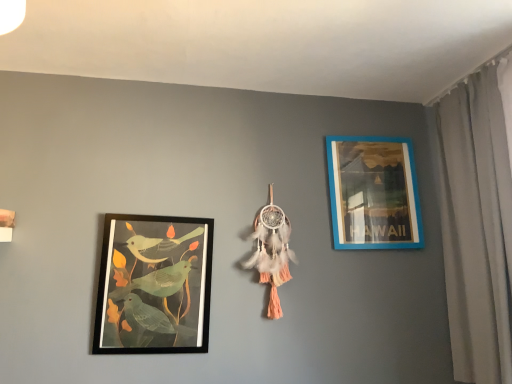
Locate an element on the screen. The height and width of the screenshot is (384, 512). white fabric curtain at right is located at coordinates (476, 227).

What is the approximate width of blue plastic picture frame at upper right, which appears as the first picture frame when viewed from the back?

blue plastic picture frame at upper right, which appears as the first picture frame when viewed from the back, is 1.79 inches in width.

Where is `blue plastic picture frame at upper right, the 2th picture frame positioned from the front`? This screenshot has height=384, width=512. blue plastic picture frame at upper right, the 2th picture frame positioned from the front is located at coordinates 373,193.

Where is `white fabric curtain at right`? The image size is (512, 384). white fabric curtain at right is located at coordinates (476, 227).

From the image's perspective, which object appears higher, blue plastic picture frame at upper right, the 2th picture frame positioned from the front, or white fabric curtain at right?

blue plastic picture frame at upper right, the 2th picture frame positioned from the front, is shown above in the image.

Looking at this image, from a real-world perspective, which object stands above the other?

blue plastic picture frame at upper right, which appears as the first picture frame when viewed from the back.

Considering the relative sizes of blue plastic picture frame at upper right, arranged as the first picture frame when viewed from the right, and white fabric curtain at right in the image provided, is blue plastic picture frame at upper right, arranged as the first picture frame when viewed from the right, taller than white fabric curtain at right?

No, blue plastic picture frame at upper right, arranged as the first picture frame when viewed from the right, is not taller than white fabric curtain at right.

Identify the location of picture frame lying above the white fabric curtain at right (from the image's perspective). (373, 193).

Can you confirm if white fabric curtain at right is smaller than blue plastic picture frame at upper right, the 2th picture frame positioned from the front?

Actually, white fabric curtain at right might be larger than blue plastic picture frame at upper right, the 2th picture frame positioned from the front.

In the scene shown: Is there a large distance between white fabric curtain at right and blue plastic picture frame at upper right, which is counted as the 2th picture frame, starting from the left?

Actually, white fabric curtain at right and blue plastic picture frame at upper right, which is counted as the 2th picture frame, starting from the left, are a little close together.

Is white fabric curtain at right aimed at blue plastic picture frame at upper right, which is counted as the 2th picture frame, starting from the left?

Yes, white fabric curtain at right is oriented towards blue plastic picture frame at upper right, which is counted as the 2th picture frame, starting from the left.

Which object is thinner, matte black picture frame at left, the first picture frame viewed from the left, or blue plastic picture frame at upper right, which appears as the first picture frame when viewed from the back?

With smaller width is blue plastic picture frame at upper right, which appears as the first picture frame when viewed from the back.

Considering the relative sizes of matte black picture frame at left, the second picture frame in the back-to-front sequence, and blue plastic picture frame at upper right, which is counted as the 2th picture frame, starting from the left, in the image provided, is matte black picture frame at left, the second picture frame in the back-to-front sequence, smaller than blue plastic picture frame at upper right, which is counted as the 2th picture frame, starting from the left,?

Incorrect, matte black picture frame at left, the second picture frame in the back-to-front sequence, is not smaller in size than blue plastic picture frame at upper right, which is counted as the 2th picture frame, starting from the left.

Measure the distance from matte black picture frame at left, the second picture frame in the back-to-front sequence, to blue plastic picture frame at upper right, the 2th picture frame positioned from the front.

matte black picture frame at left, the second picture frame in the back-to-front sequence, is 31.42 inches away from blue plastic picture frame at upper right, the 2th picture frame positioned from the front.

Visually, is matte black picture frame at left, arranged as the second picture frame when viewed from the right, positioned to the left or to the right of blue plastic picture frame at upper right, which appears as the first picture frame when viewed from the back?

matte black picture frame at left, arranged as the second picture frame when viewed from the right, is positioned on blue plastic picture frame at upper right, which appears as the first picture frame when viewed from the back,'s left side.

In the scene shown: Considering the relative sizes of matte black picture frame at left, the first picture frame viewed from the left, and white fabric curtain at right in the image provided, is matte black picture frame at left, the first picture frame viewed from the left, smaller than white fabric curtain at right?

Yes, matte black picture frame at left, the first picture frame viewed from the left, is smaller than white fabric curtain at right.

Is matte black picture frame at left, arranged as the second picture frame when viewed from the right, not near white fabric curtain at right?

Yes, matte black picture frame at left, arranged as the second picture frame when viewed from the right, is far from white fabric curtain at right.

The image size is (512, 384). I want to click on curtain above the matte black picture frame at left, the second picture frame in the back-to-front sequence (from the image's perspective), so click(476, 227).

Is matte black picture frame at left, which ranks as the first picture frame in front-to-back order, thinner than white fabric curtain at right?

Yes.

Is blue plastic picture frame at upper right, which is counted as the 2th picture frame, starting from the left, spatially inside matte black picture frame at left, the first picture frame viewed from the left, or outside of it?

blue plastic picture frame at upper right, which is counted as the 2th picture frame, starting from the left, exists outside the volume of matte black picture frame at left, the first picture frame viewed from the left.

From a real-world perspective, who is located higher, blue plastic picture frame at upper right, arranged as the first picture frame when viewed from the right, or matte black picture frame at left, the first picture frame viewed from the left?

blue plastic picture frame at upper right, arranged as the first picture frame when viewed from the right, from a real-world perspective.

You are a GUI agent. You are given a task and a screenshot of the screen. Output one action in this format:
    pyautogui.click(x=<x>, y=<y>)
    Task: Click on the picture frame behind the matte black picture frame at left, which ranks as the first picture frame in front-to-back order
    
    Given the screenshot: What is the action you would take?
    pyautogui.click(x=373, y=193)

Which is in front, point (364, 149) or point (114, 347)?

The point (114, 347) is closer to the camera.

Considering the sizes of objects white fabric curtain at right and matte black picture frame at left, the second picture frame in the back-to-front sequence, in the image provided, who is thinner, white fabric curtain at right or matte black picture frame at left, the second picture frame in the back-to-front sequence,?

With smaller width is matte black picture frame at left, the second picture frame in the back-to-front sequence.

From their relative heights in the image, would you say white fabric curtain at right is taller or shorter than matte black picture frame at left, arranged as the second picture frame when viewed from the right?

Considering their sizes, white fabric curtain at right has more height than matte black picture frame at left, arranged as the second picture frame when viewed from the right.

Where is `curtain above the matte black picture frame at left, arranged as the second picture frame when viewed from the right (from a real-world perspective)`? This screenshot has width=512, height=384. curtain above the matte black picture frame at left, arranged as the second picture frame when viewed from the right (from a real-world perspective) is located at coordinates (476, 227).

Where is `the 1st picture frame to the left when counting from the white fabric curtain at right`? the 1st picture frame to the left when counting from the white fabric curtain at right is located at coordinates tap(373, 193).

The image size is (512, 384). I want to click on curtain on the right of the blue plastic picture frame at upper right, which appears as the first picture frame when viewed from the back, so click(x=476, y=227).

When comparing their distances from white fabric curtain at right, does matte black picture frame at left, which ranks as the first picture frame in front-to-back order, or blue plastic picture frame at upper right, arranged as the first picture frame when viewed from the right, seem further?

Based on the image, matte black picture frame at left, which ranks as the first picture frame in front-to-back order, appears to be further to white fabric curtain at right.

Looking at the image, which one is located closer to matte black picture frame at left, the first picture frame viewed from the left, blue plastic picture frame at upper right, which appears as the first picture frame when viewed from the back, or white fabric curtain at right?

blue plastic picture frame at upper right, which appears as the first picture frame when viewed from the back, is closer to matte black picture frame at left, the first picture frame viewed from the left.

Estimate the real-world distances between objects in this image. Which object is further from blue plastic picture frame at upper right, the 2th picture frame positioned from the front, white fabric curtain at right or matte black picture frame at left, the first picture frame viewed from the left?

matte black picture frame at left, the first picture frame viewed from the left, is further to blue plastic picture frame at upper right, the 2th picture frame positioned from the front.

Considering their positions, is blue plastic picture frame at upper right, arranged as the first picture frame when viewed from the right, positioned closer to white fabric curtain at right than matte black picture frame at left, arranged as the second picture frame when viewed from the right?

blue plastic picture frame at upper right, arranged as the first picture frame when viewed from the right, is closer to white fabric curtain at right.

Estimate the real-world distances between objects in this image. Which object is closer to matte black picture frame at left, the second picture frame in the back-to-front sequence, white fabric curtain at right or blue plastic picture frame at upper right, arranged as the first picture frame when viewed from the right?

Based on the image, blue plastic picture frame at upper right, arranged as the first picture frame when viewed from the right, appears to be nearer to matte black picture frame at left, the second picture frame in the back-to-front sequence.

Based on their spatial positions, is matte black picture frame at left, the second picture frame in the back-to-front sequence, or white fabric curtain at right closer to blue plastic picture frame at upper right, the 2th picture frame positioned from the front?

white fabric curtain at right.

Where is `picture frame located between matte black picture frame at left, arranged as the second picture frame when viewed from the right, and white fabric curtain at right in the left-right direction`? This screenshot has height=384, width=512. picture frame located between matte black picture frame at left, arranged as the second picture frame when viewed from the right, and white fabric curtain at right in the left-right direction is located at coordinates (373, 193).